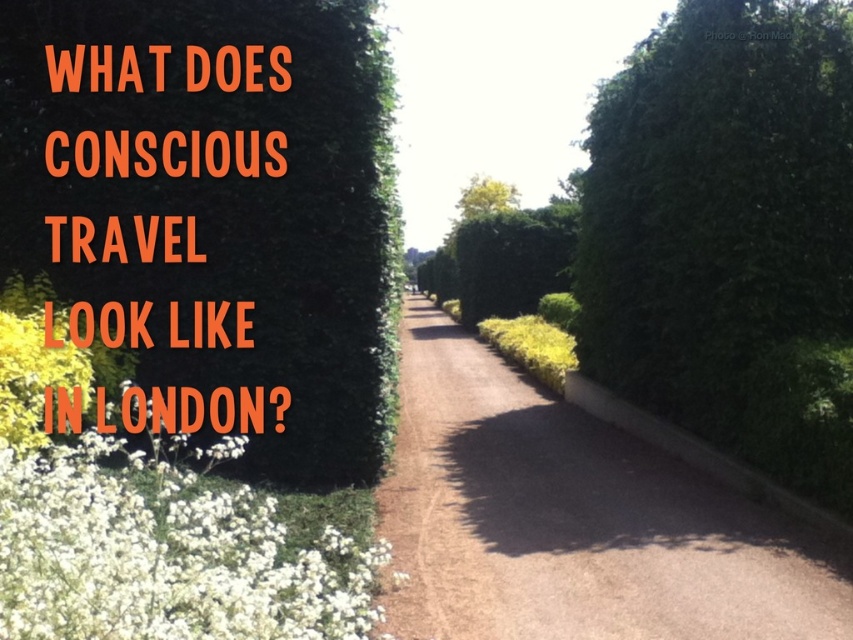
Question: Based on their relative distances, which object is farther from the white fluffy petals at lower left?

Choices:
 (A) brown gravel driveway at center
 (B) green leafy tree at center
 (C) green leafy hedge at upper left

Answer: (B)

Question: Is green leafy hedge at upper left further to the viewer compared to white fluffy petals at lower left?

Choices:
 (A) yes
 (B) no

Answer: (A)

Question: Which object is the farthest from the white fluffy petals at lower left?

Choices:
 (A) green leafy hedge at upper left
 (B) green leafy tree at center
 (C) brown gravel driveway at center

Answer: (B)

Question: Does brown gravel driveway at center appear on the left side of green leafy tree at center?

Choices:
 (A) yes
 (B) no

Answer: (A)

Question: Among these points, which one is nearest to the camera?

Choices:
 (A) (334, 77)
 (B) (486, 209)

Answer: (A)

Question: Is green leafy hedge at upper left to the left of brown gravel driveway at center from the viewer's perspective?

Choices:
 (A) no
 (B) yes

Answer: (B)